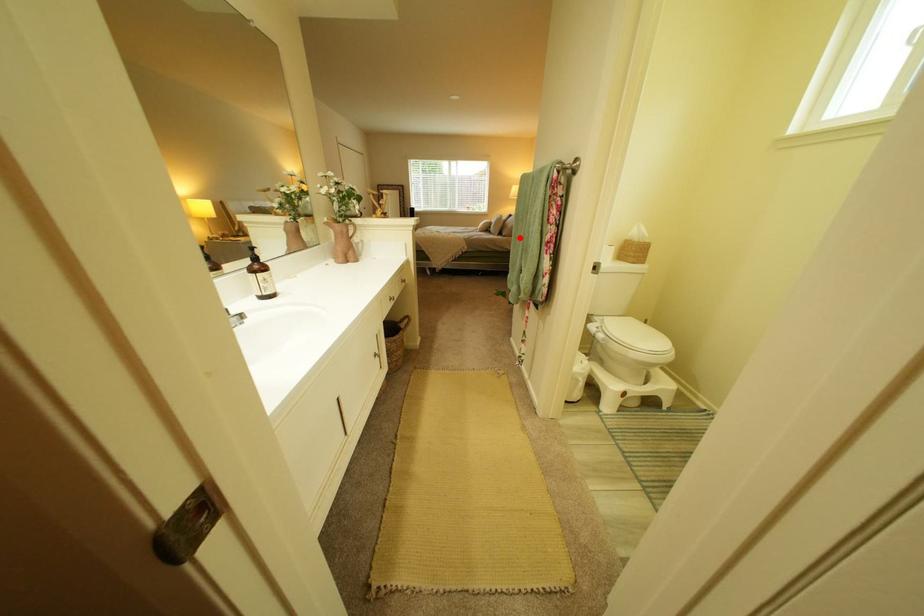
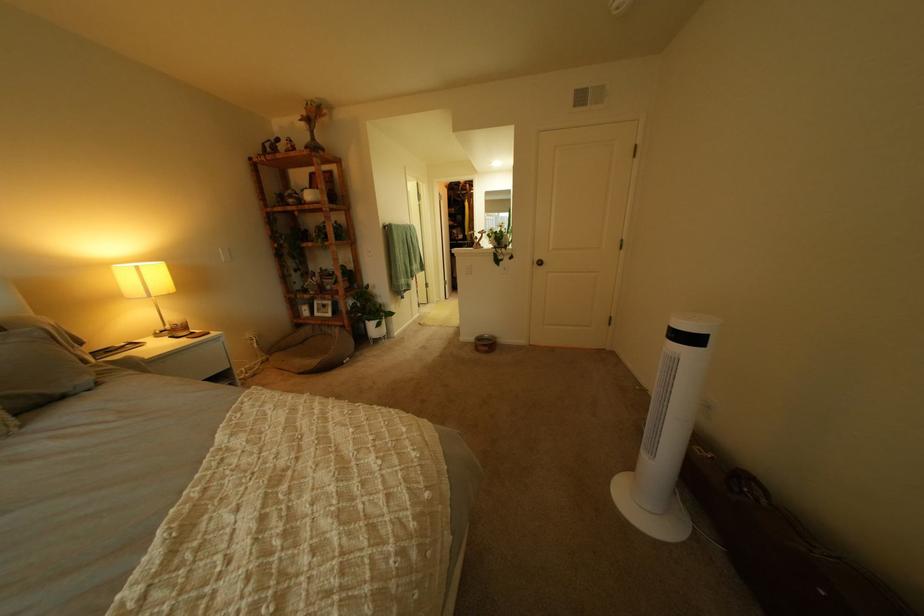
Question: I am providing you with two images of the same scene from different viewpoints. Given a red point in image1, look at the same physical point in image2. Is it:

Choices:
 (A) Closer to the viewpoint
 (B) Farther from the viewpoint

Answer: (B)